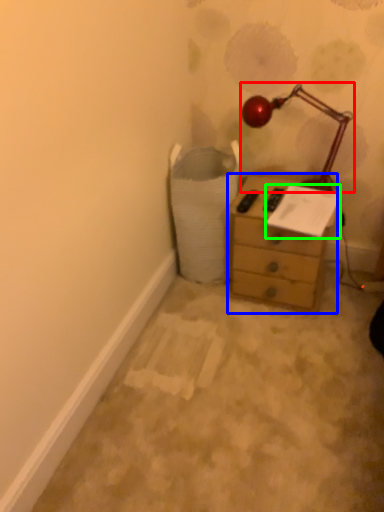
Question: Based on their relative distances, which object is nearer to lamp (highlighted by a red box)? Choose from chest of drawers (highlighted by a blue box) and paper (highlighted by a green box).

Choices:
 (A) chest of drawers
 (B) paper

Answer: (B)